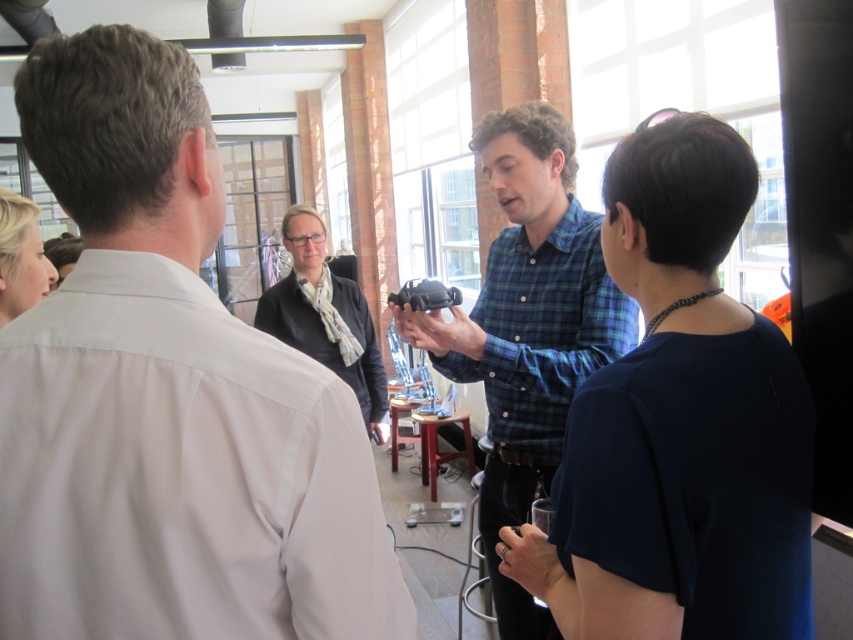
Is white shirt at left to the right of dark gray sweater at center from the viewer's perspective?

Yes, white shirt at left is to the right of dark gray sweater at center.

Describe the element at coordinates (167, 396) in the screenshot. I see `white shirt at left` at that location.

Who is more distant from viewer, (100, 65) or (346, 369)?

The point (346, 369) is behind.

You are a GUI agent. You are given a task and a screenshot of the screen. Output one action in this format:
    pyautogui.click(x=<x>, y=<y>)
    Task: Click on the white shirt at left
    
    Given the screenshot: What is the action you would take?
    pyautogui.click(x=167, y=396)

The width and height of the screenshot is (853, 640). Describe the element at coordinates (527, 326) in the screenshot. I see `blue plaid shirt at center` at that location.

Is point (546, 413) in front of point (361, 333)?

Yes, it is.

This screenshot has height=640, width=853. Identify the location of blue plaid shirt at center. [x=527, y=326].

Can you confirm if dark blue fabric shirt at center is wider than blue plaid shirt at center?

No.

Is dark blue fabric shirt at center to the left of blue plaid shirt at center from the viewer's perspective?

No, dark blue fabric shirt at center is not to the left of blue plaid shirt at center.

Is point (589, 582) positioned behind point (525, 481)?

No, it is not.

Locate an element on the screen. Image resolution: width=853 pixels, height=640 pixels. dark blue fabric shirt at center is located at coordinates (680, 424).